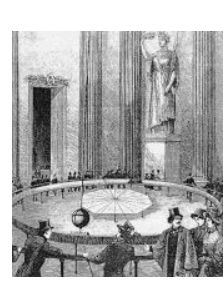
Identify the location of statue. The image size is (223, 303). (156, 100), (161, 65).